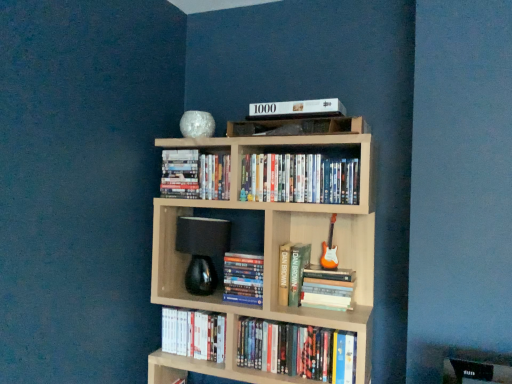
Question: From the image's perspective, is hardcover book at upper center, positioned as the 2th book in top-to-bottom order, above or below white matte book at upper center, the eighth book ordered from the bottom?

Choices:
 (A) above
 (B) below

Answer: (B)

Question: In the image, is hardcover book at upper center, positioned as the 2th book in top-to-bottom order, positioned in front of or behind white matte book at upper center, the eighth book ordered from the bottom?

Choices:
 (A) front
 (B) behind

Answer: (B)

Question: Which is farther from the matte white dvd at lower center, which is the 2th book from bottom to top?

Choices:
 (A) hardcover book at center, the sixth book positioned from the top
 (B) black glass lamp at center
 (C) hardcover book at center, which ranks as the 4th book in bottom-to-top order
 (D) matte plastic dvds at upper center, which ranks as the 6th book in bottom-to-top order
 (E) hardcover book at upper center, arranged as the 7th book when ordered from the bottom

Answer: (D)

Question: Which object is the closest to the light wood bookcase at center?

Choices:
 (A) hardcover book at center, acting as the fifth book starting from the top
 (B) matte white dvd at lower center, which is counted as the seventh book, starting from the top
 (C) black glass lamp at center
 (D) white matte book at upper center, the eighth book ordered from the bottom
 (E) hardcover book at center, the sixth book positioned from the top

Answer: (A)